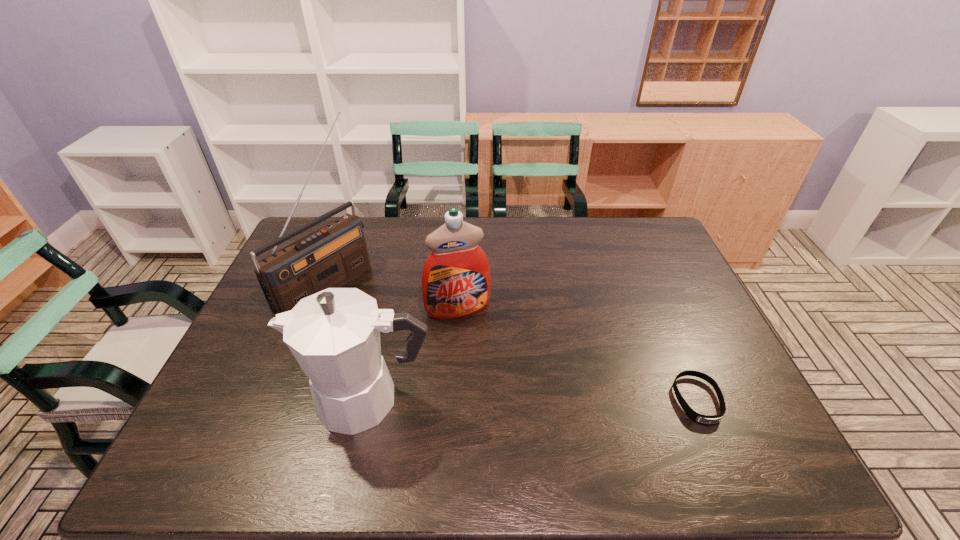
Identify the location of coffeepot. This screenshot has height=540, width=960. (334, 335).

Locate an element on the screen. This screenshot has width=960, height=540. the shortest object is located at coordinates (699, 418).

Identify the location of the rightmost object. The width and height of the screenshot is (960, 540). (699, 418).

Where is `the tallest object`? This screenshot has width=960, height=540. the tallest object is located at coordinates (331, 256).

Where is `detergent`? This screenshot has width=960, height=540. detergent is located at coordinates (456, 282).

Locate an element on the screen. This screenshot has width=960, height=540. vacant area situated 0.190m at the spout of the coffeepot is located at coordinates (224, 400).

Locate an element on the screen. The width and height of the screenshot is (960, 540). free location located at the spout of the coffeepot is located at coordinates (249, 400).

Find the location of a particular element. This screenshot has height=540, width=960. free spot located 0.060m at the spout of the coffeepot is located at coordinates (277, 400).

The height and width of the screenshot is (540, 960). What are the coordinates of `vacant space located 0.270m on the front-facing side of the tallest object` in the screenshot? It's located at (416, 348).

Find the location of a particular element. The width and height of the screenshot is (960, 540). free region located 0.400m on the front-facing side of the tallest object is located at coordinates (452, 373).